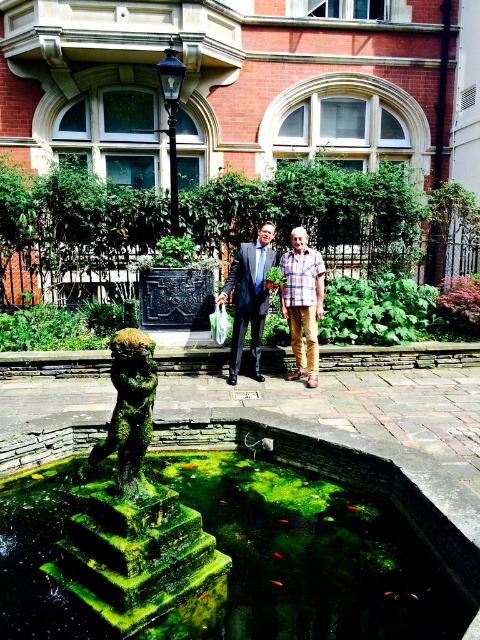
Does plaid fabric shirt at center come behind orange shiny fish at center?

Yes, it is behind orange shiny fish at center.

Is point (311, 266) closer to viewer compared to point (273, 579)?

No.

Find the location of a particular element. plaid fabric shirt at center is located at coordinates (250, 298).

Who is higher up, green mossy stone at center or orange shiny fish at center?

green mossy stone at center is higher up.

Where is `green mossy stone at center`? The height and width of the screenshot is (640, 480). green mossy stone at center is located at coordinates (305, 556).

Is plaid shirt at center to the right of black metal lamp post at upper center from the viewer's perspective?

Correct, you'll find plaid shirt at center to the right of black metal lamp post at upper center.

Between plaid shirt at center and black metal lamp post at upper center, which one appears on the left side from the viewer's perspective?

From the viewer's perspective, black metal lamp post at upper center appears more on the left side.

Which is in front, point (316, 278) or point (171, 182)?

Point (316, 278) is more forward.

Where is `plaid shirt at center`? Image resolution: width=480 pixels, height=640 pixels. plaid shirt at center is located at coordinates (302, 301).